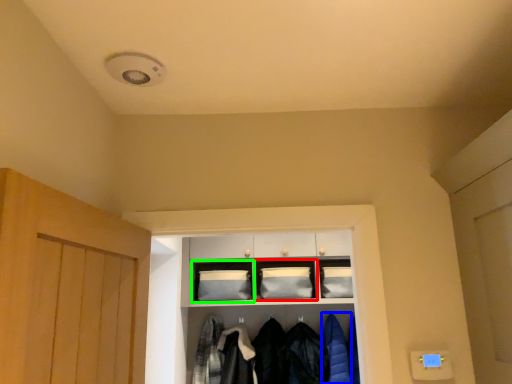
Question: Which is farther away from shelf (highlighted by a red box)? clothing (highlighted by a blue box) or cabinetry (highlighted by a green box)?

Choices:
 (A) clothing
 (B) cabinetry

Answer: (A)